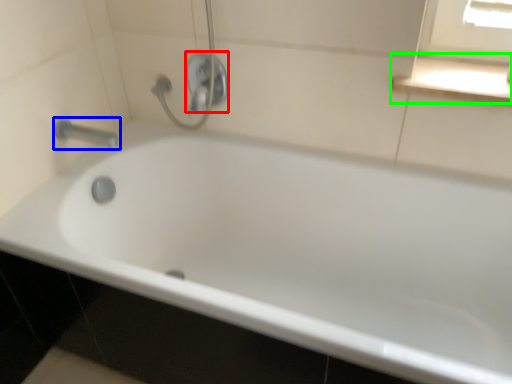
Question: Which object is positioned farthest from shower (highlighted by a red box)? Select from tap (highlighted by a blue box) and window sill (highlighted by a green box).

Choices:
 (A) tap
 (B) window sill

Answer: (B)